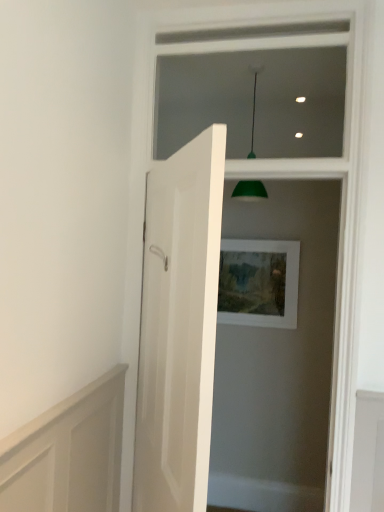
Question: From the image's perspective, is white wood frame at upper center on white matte picture frame at center?

Choices:
 (A) yes
 (B) no

Answer: (A)

Question: From the image's perspective, is white wood frame at upper center under white matte picture frame at center?

Choices:
 (A) yes
 (B) no

Answer: (B)

Question: Considering the relative sizes of white wood frame at upper center and white matte picture frame at center in the image provided, is white wood frame at upper center wider than white matte picture frame at center?

Choices:
 (A) no
 (B) yes

Answer: (B)

Question: From a real-world perspective, does white wood frame at upper center stand above white matte picture frame at center?

Choices:
 (A) yes
 (B) no

Answer: (A)

Question: Can we say white wood frame at upper center lies outside white matte picture frame at center?

Choices:
 (A) no
 (B) yes

Answer: (B)

Question: Is white wood frame at upper center further to camera compared to white matte picture frame at center?

Choices:
 (A) yes
 (B) no

Answer: (B)

Question: Is green matte lampshade at upper center located outside white glossy door at center?

Choices:
 (A) no
 (B) yes

Answer: (B)

Question: Does green matte lampshade at upper center have a lesser width compared to white glossy door at center?

Choices:
 (A) no
 (B) yes

Answer: (A)

Question: Does green matte lampshade at upper center have a greater height compared to white glossy door at center?

Choices:
 (A) no
 (B) yes

Answer: (A)

Question: From a real-world perspective, is green matte lampshade at upper center below white glossy door at center?

Choices:
 (A) no
 (B) yes

Answer: (A)

Question: From the image's perspective, does green matte lampshade at upper center appear lower than white glossy door at center?

Choices:
 (A) yes
 (B) no

Answer: (B)

Question: Does green matte lampshade at upper center turn towards white glossy door at center?

Choices:
 (A) no
 (B) yes

Answer: (A)

Question: Is white wood frame at upper center oriented towards green matte lampshade at upper center?

Choices:
 (A) yes
 (B) no

Answer: (A)